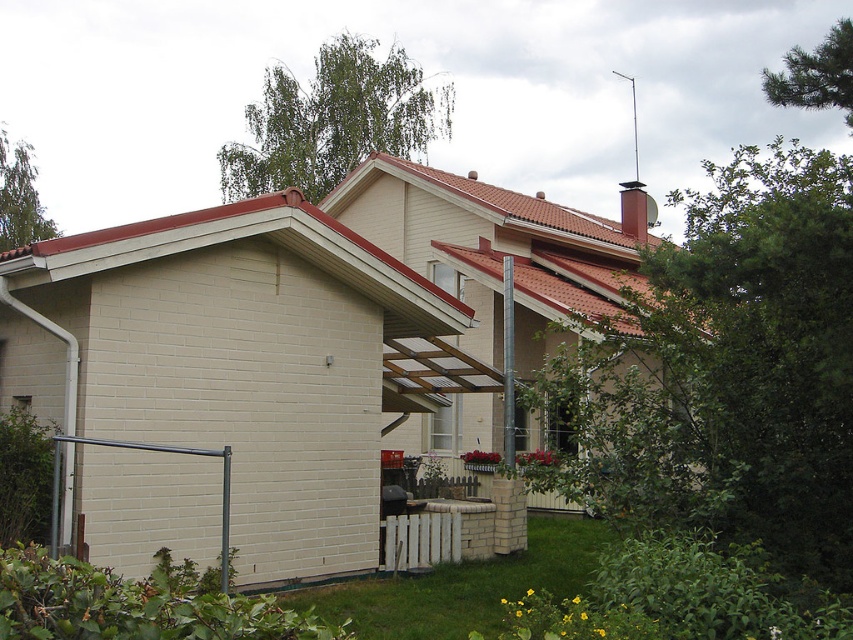
Question: Among these points, which one is farthest from the camera?

Choices:
 (A) (392, 556)
 (B) (55, 497)

Answer: (A)

Question: Which point is farther to the camera?

Choices:
 (A) metallic gray rail at lower left
 (B) white wooden fence at lower center

Answer: (B)

Question: Does white wooden fence at lower center appear over metallic gray rail at lower left?

Choices:
 (A) yes
 (B) no

Answer: (B)

Question: Is white wooden fence at lower center to the right of metallic gray rail at lower left from the viewer's perspective?

Choices:
 (A) yes
 (B) no

Answer: (A)

Question: Observing the image, what is the correct spatial positioning of white wooden fence at lower center in reference to metallic gray rail at lower left?

Choices:
 (A) left
 (B) right

Answer: (B)